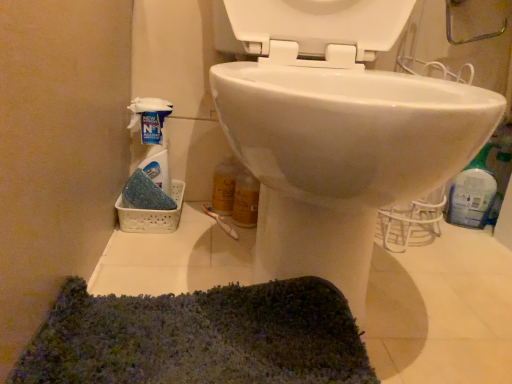
Image resolution: width=512 pixels, height=384 pixels. Identify the location of free space on the front side of white plastic spray bottle at left, the first cleaning product positioned from the left. (150, 256).